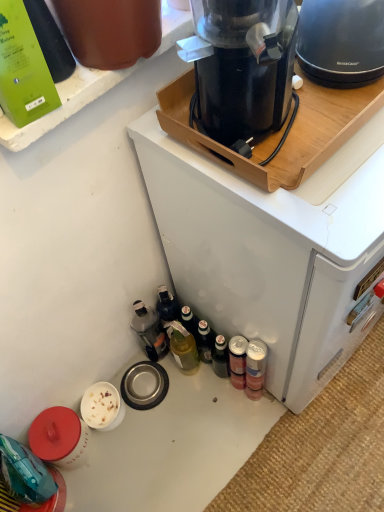
Question: From a real-world perspective, is green matte bottle at upper left, which is counted as the third bottle, starting from the back, above or below metallic silver can at lower right, which is the 3th bottle in left-to-right order?

Choices:
 (A) above
 (B) below

Answer: (A)

Question: Is point pyautogui.click(x=43, y=25) positioned closer to the camera than point pyautogui.click(x=258, y=382)?

Choices:
 (A) closer
 (B) farther

Answer: (A)

Question: Based on their relative distances, which object is farther from the green matte bottle at upper left, the 3th bottle positioned from the right?

Choices:
 (A) black plastic coffee maker at upper center
 (B) translucent plastic bottle at lower left, which is counted as the 2th bottle, starting from the left
 (C) metallic silver can at lower right, which is the 3th bottle in left-to-right order
 (D) matte black kettle at upper right, which appears as the 2th kitchen appliance when viewed from the left
 (E) black plastic coffee maker at upper center, which appears as the second kitchen appliance when viewed from the right

Answer: (B)

Question: Estimate the real-world distances between objects in this image. Which object is closer to the black plastic coffee maker at upper center?

Choices:
 (A) translucent plastic bottle at lower left, which is the third bottle in front-to-back order
 (B) matte black kettle at upper right, which appears as the 2th kitchen appliance when viewed from the left
 (C) black plastic coffee maker at upper center, which appears as the second kitchen appliance when viewed from the right
 (D) metallic silver can at lower right, the 2th bottle viewed from the back
 (E) green matte bottle at upper left, the first bottle when ordered from left to right

Answer: (C)